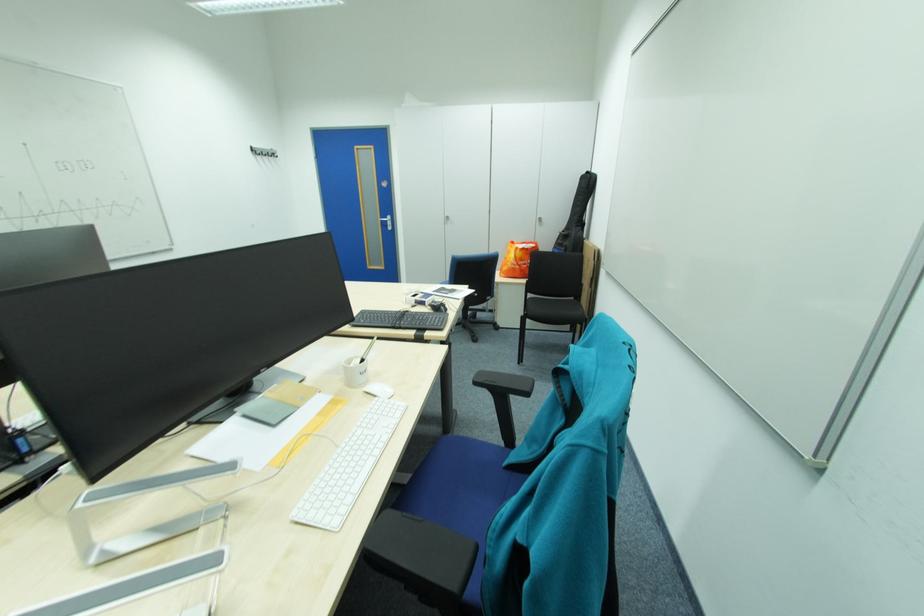
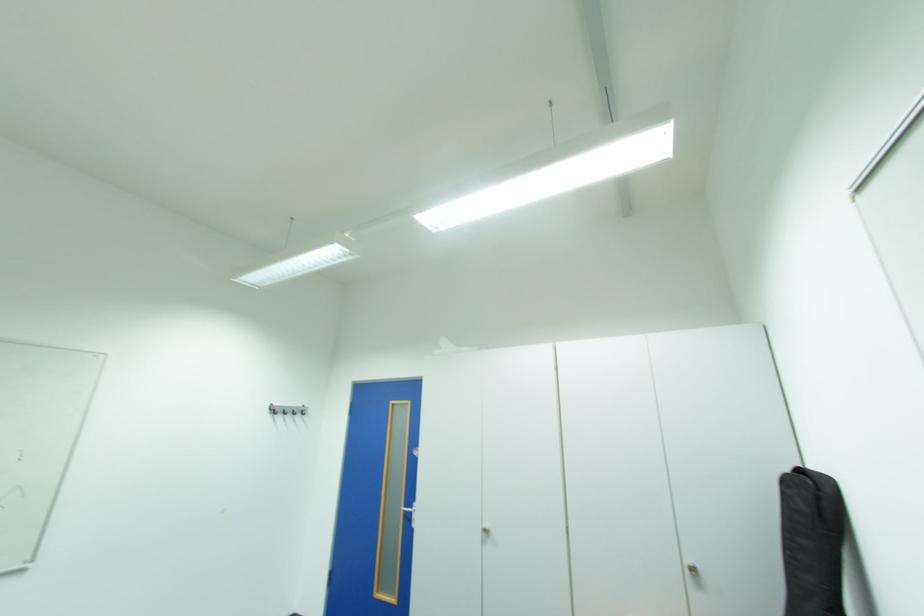
Find the pixel in the second image that matches [456,217] in the first image.

(495, 532)